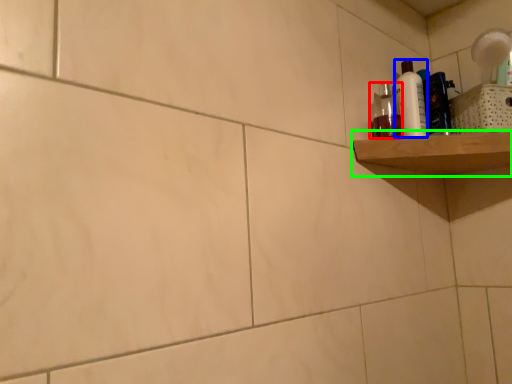
Question: Which object is the farthest from mouthwash (highlighted by a red box)? Choose among these: cleaning product (highlighted by a blue box) or shelf (highlighted by a green box).

Choices:
 (A) cleaning product
 (B) shelf

Answer: (B)